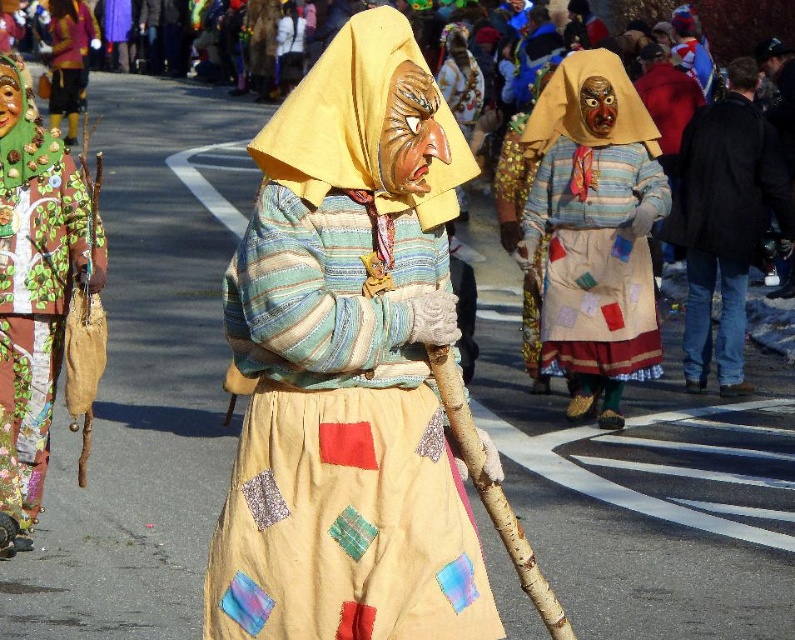
Question: Is matte yellow fabric mask at center wider than black wool coat at right?

Choices:
 (A) yes
 (B) no

Answer: (A)

Question: Which of these objects is positioned closest to the black wool coat at right?

Choices:
 (A) matte yellow fabric mask at center
 (B) green leafy fabric bag at left

Answer: (B)

Question: Is matte yellow fabric mask at center to the left of green leafy fabric bag at left from the viewer's perspective?

Choices:
 (A) no
 (B) yes

Answer: (A)

Question: Among these points, which one is nearest to the camera?

Choices:
 (A) (332, 573)
 (B) (739, 147)
 (C) (33, 328)

Answer: (A)

Question: Which point appears farthest from the camera in this image?

Choices:
 (A) [417, 160]
 (B) [712, 106]

Answer: (B)

Question: Is matte yellow fabric mask at center wider than green leafy fabric bag at left?

Choices:
 (A) yes
 (B) no

Answer: (A)